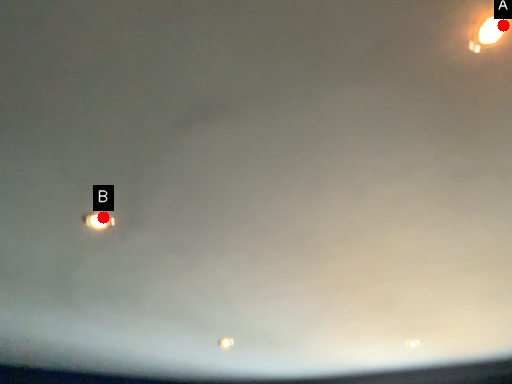
Question: Two points are circled on the image, labeled by A and B beside each circle. Which of the following is the closest to the observer?

Choices:
 (A) A is closer
 (B) B is closer

Answer: (A)